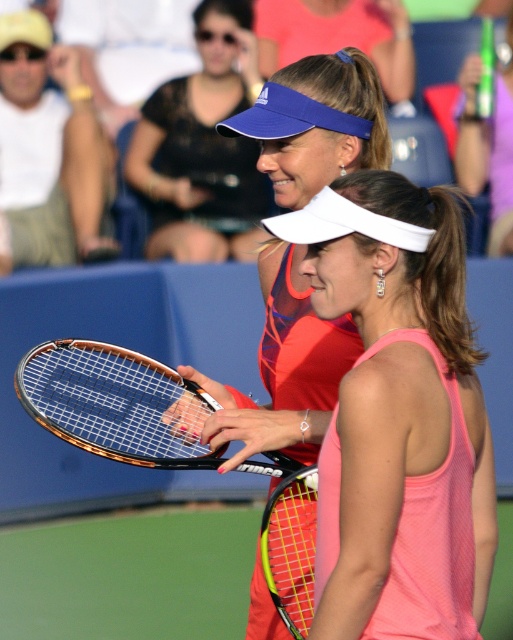
Question: Can you confirm if pink fabric tennis dress at center is positioned to the right of matte blue visor at center?

Choices:
 (A) yes
 (B) no

Answer: (B)

Question: Among these points, which one is nearest to the camera?

Choices:
 (A) (167, 435)
 (B) (369, 326)
 (C) (225, 65)

Answer: (B)

Question: Which point appears farthest from the camera in this image?

Choices:
 (A) (261, 96)
 (B) (94, 403)
 (C) (323, 624)

Answer: (A)

Question: Does pink fabric tennis dress at center appear on the left side of matte blue visor at upper center?

Choices:
 (A) yes
 (B) no

Answer: (B)

Question: Is matte blue visor at upper center to the left of blue fabric visor at center from the viewer's perspective?

Choices:
 (A) no
 (B) yes

Answer: (B)

Question: Which of the following is the closest to the observer?

Choices:
 (A) (165, 400)
 (B) (198, 170)

Answer: (A)